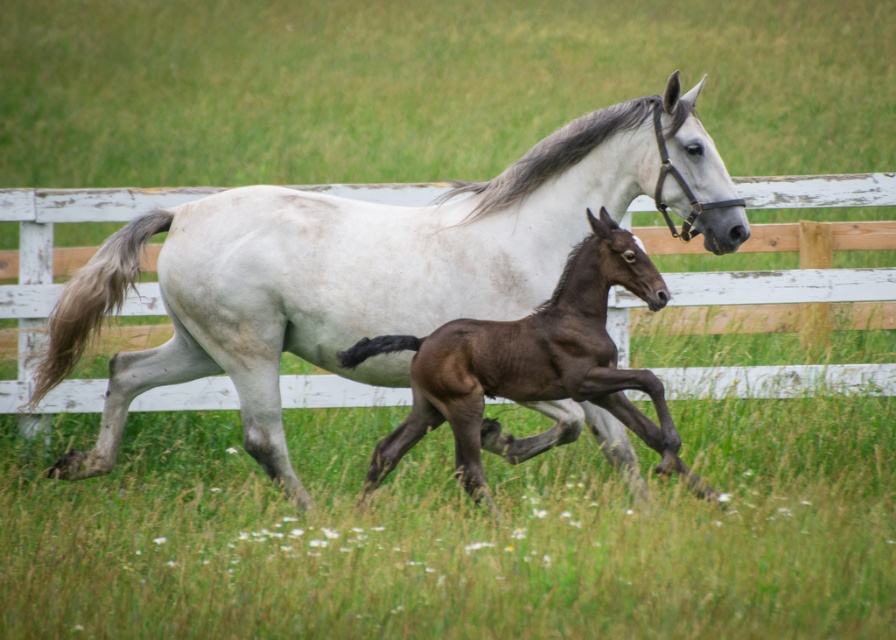
Who is positioned more to the right, white glossy horse at center or shiny brown foal at center?

shiny brown foal at center is more to the right.

Who is higher up, white glossy horse at center or shiny brown foal at center?

white glossy horse at center

Which is in front, point (99, 452) or point (649, 380)?

Point (649, 380) is more forward.

I want to click on white glossy horse at center, so click(x=369, y=268).